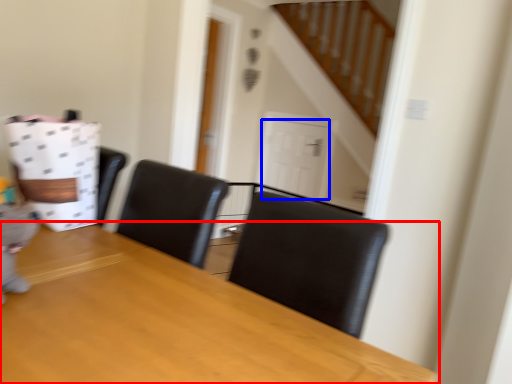
Question: Which object is further to the camera taking this photo, table (highlighted by a red box) or door (highlighted by a blue box)?

Choices:
 (A) table
 (B) door

Answer: (B)